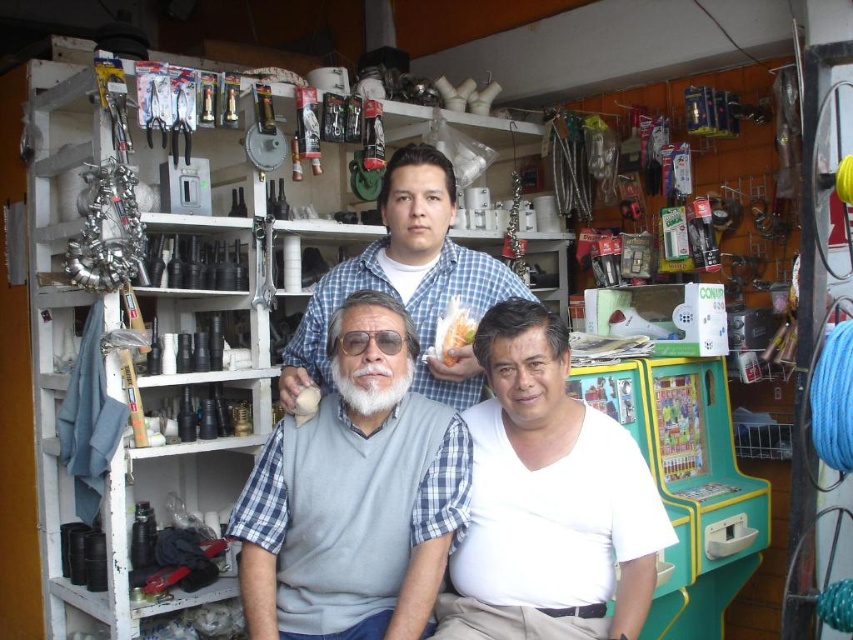
You are a tailor measuring clothing items in a store. You need to determine which of the two items, the gray matte vest at center or the white matte shirt at center, is taller. Based on the description, which one is taller?

The gray matte vest at center is taller than the white matte shirt at center according to the description.

What are the coordinates of the gray matte vest at center?

The gray matte vest at center is located at coordinates point (354, 496).